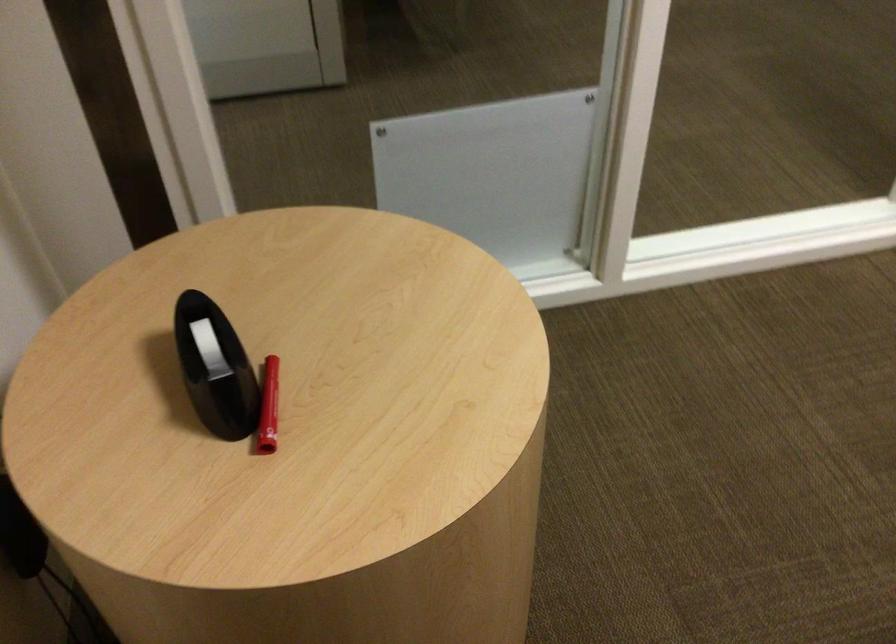
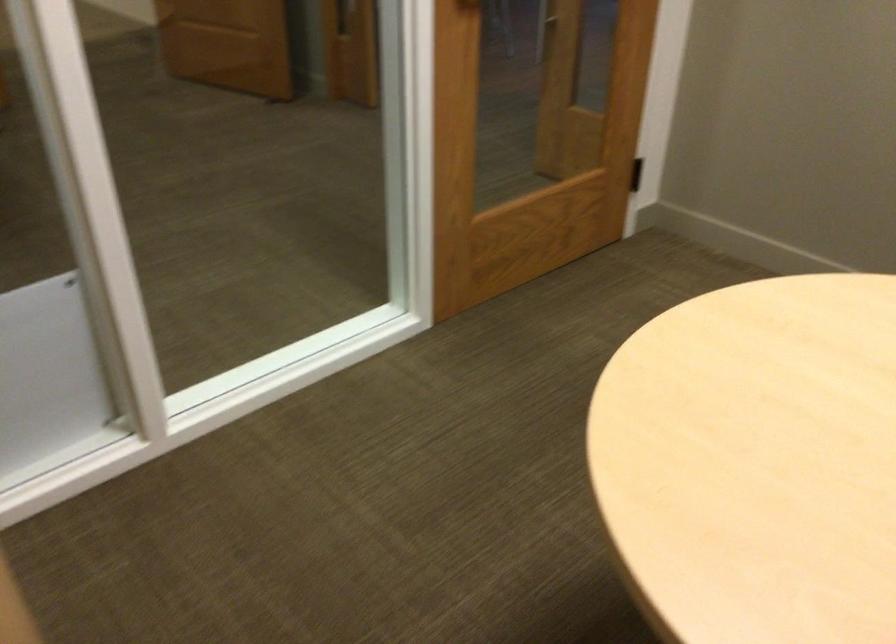
Question: The camera is either moving clockwise (left) or counter-clockwise (right) around the object. The first image is from the beginning of the video and the second image is from the end. Is the camera moving left or right when shooting the video?

Choices:
 (A) Left
 (B) Right

Answer: (A)